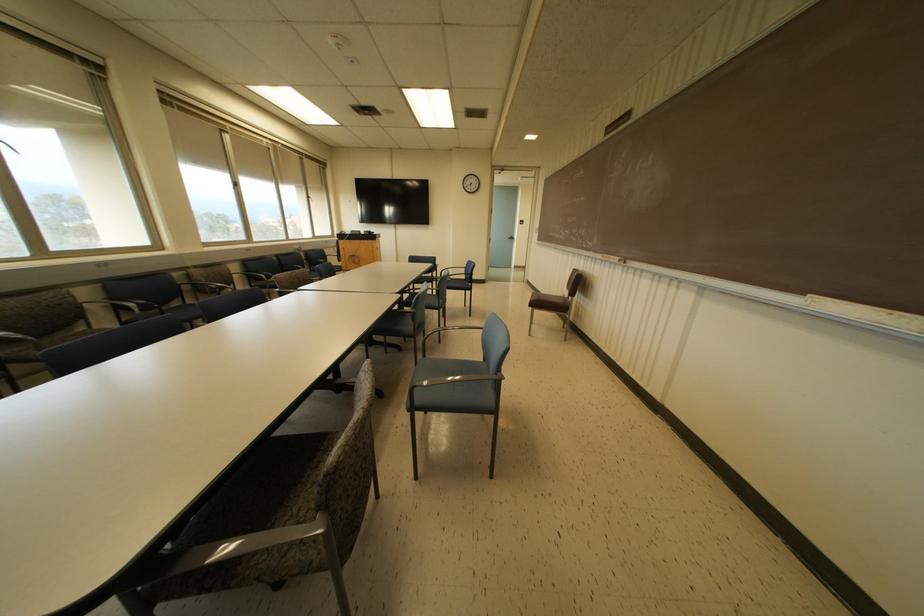
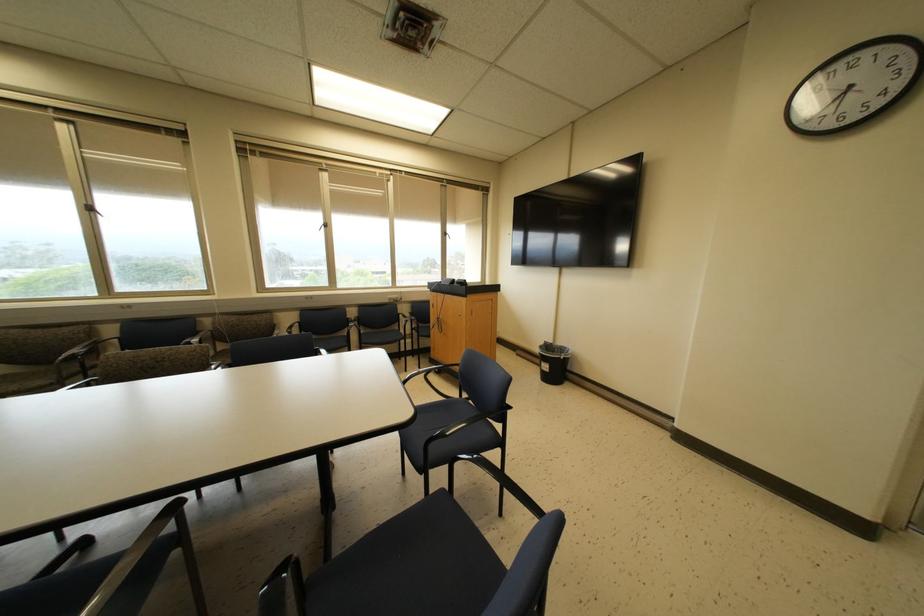
Find the pixel in the second image that matches (308,197) in the first image.

(444, 233)